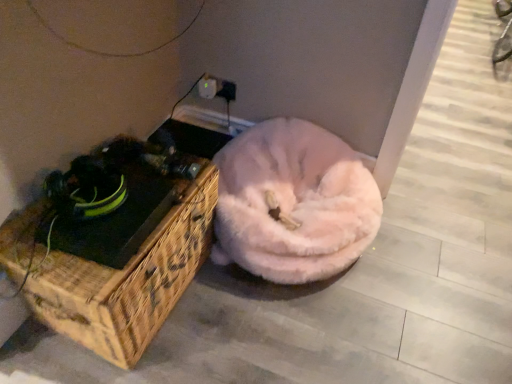
Image resolution: width=512 pixels, height=384 pixels. In order to click on fuzzy pink dog bed at center in this screenshot , I will do `click(293, 203)`.

The width and height of the screenshot is (512, 384). I want to click on white plastic electric outlet at upper center, so click(x=207, y=87).

This screenshot has height=384, width=512. I want to click on woven wood chest at left, so pos(115,258).

Considering the relative sizes of white plastic electric outlet at upper center and woven wood chest at left in the image provided, is white plastic electric outlet at upper center wider than woven wood chest at left?

No, white plastic electric outlet at upper center is not wider than woven wood chest at left.

From the image's perspective, between white plastic electric outlet at upper center and woven wood chest at left, who is located below?

woven wood chest at left, from the image's perspective.

Is woven wood chest at left a part of white plastic electric outlet at upper center?

No, woven wood chest at left is not a part of white plastic electric outlet at upper center.

Is white plastic electric outlet at upper center far away from woven wood chest at left?

No.

Can you tell me how much woven wood chest at left and fuzzy pink dog bed at center differ in facing direction?

They differ by 90 degrees in their facing directions.

Measure the distance between woven wood chest at left and fuzzy pink dog bed at center.

A distance of 14.35 inches exists between woven wood chest at left and fuzzy pink dog bed at center.

Is woven wood chest at left taller than fuzzy pink dog bed at center?

Indeed, woven wood chest at left has a greater height compared to fuzzy pink dog bed at center.

From a real-world perspective, is woven wood chest at left located beneath fuzzy pink dog bed at center?

No, from a real-world perspective, woven wood chest at left is not under fuzzy pink dog bed at center.

Is point (117, 291) positioned behind point (208, 95)?

That is False.

Which of these two, woven wood chest at left or white plastic electric outlet at upper center, is thinner?

white plastic electric outlet at upper center is thinner.

Can you confirm if woven wood chest at left is smaller than white plastic electric outlet at upper center?

No, woven wood chest at left is not smaller than white plastic electric outlet at upper center.

Considering the sizes of woven wood chest at left and white plastic electric outlet at upper center in the image, is woven wood chest at left taller or shorter than white plastic electric outlet at upper center?

In the image, woven wood chest at left appears to be taller than white plastic electric outlet at upper center.

Based on the photo, from a real-world perspective, is white plastic electric outlet at upper center below fuzzy pink dog bed at center?

Incorrect, from a real-world perspective, white plastic electric outlet at upper center is higher than fuzzy pink dog bed at center.

Identify the location of dog bed to the right of white plastic electric outlet at upper center. (293, 203).

Is white plastic electric outlet at upper center looking in the opposite direction of fuzzy pink dog bed at center?

No, fuzzy pink dog bed at center is not at the back of white plastic electric outlet at upper center.

Does point (201, 79) come behind point (219, 171)?

Yes, point (201, 79) is behind point (219, 171).

From the picture: Could you tell me if fuzzy pink dog bed at center is facing woven wood chest at left?

No, fuzzy pink dog bed at center is not oriented towards woven wood chest at left.

From a real-world perspective, is fuzzy pink dog bed at center over woven wood chest at left?

No, from a real-world perspective, fuzzy pink dog bed at center is not above woven wood chest at left.

Which is behind, point (331, 200) or point (50, 321)?

The point (331, 200) is more distant.

What's the angular difference between fuzzy pink dog bed at center and woven wood chest at left's facing directions?

The angular difference between fuzzy pink dog bed at center and woven wood chest at left is 90 degrees.

Can you confirm if fuzzy pink dog bed at center is taller than white plastic electric outlet at upper center?

Yes.

From a real-world perspective, is fuzzy pink dog bed at center located beneath white plastic electric outlet at upper center?

Indeed, from a real-world perspective, fuzzy pink dog bed at center is positioned beneath white plastic electric outlet at upper center.

Can you tell me how much fuzzy pink dog bed at center and white plastic electric outlet at upper center differ in facing direction?

0.00282 degrees separate the facing orientations of fuzzy pink dog bed at center and white plastic electric outlet at upper center.

Is the surface of fuzzy pink dog bed at center in direct contact with white plastic electric outlet at upper center?

fuzzy pink dog bed at center and white plastic electric outlet at upper center are clearly separated.

What are the coordinates of `furniture below the white plastic electric outlet at upper center (from a real-world perspective)` in the screenshot? It's located at (115, 258).

Locate an element on the screen. The width and height of the screenshot is (512, 384). furniture that appears below the fuzzy pink dog bed at center (from the image's perspective) is located at coordinates (115, 258).

Based on their spatial positions, is fuzzy pink dog bed at center or woven wood chest at left further from white plastic electric outlet at upper center?

The object further to white plastic electric outlet at upper center is woven wood chest at left.

Considering their positions, is woven wood chest at left positioned further to fuzzy pink dog bed at center than white plastic electric outlet at upper center?

white plastic electric outlet at upper center is further to fuzzy pink dog bed at center.

When comparing their distances from woven wood chest at left, does fuzzy pink dog bed at center or white plastic electric outlet at upper center seem further?

white plastic electric outlet at upper center is positioned further to the anchor woven wood chest at left.

Looking at this image, looking at the image, which one is located further to woven wood chest at left, white plastic electric outlet at upper center or fuzzy pink dog bed at center?

white plastic electric outlet at upper center is positioned further to the anchor woven wood chest at left.

When comparing their distances from white plastic electric outlet at upper center, does woven wood chest at left or fuzzy pink dog bed at center seem closer?

fuzzy pink dog bed at center is closer to white plastic electric outlet at upper center.

When comparing their distances from fuzzy pink dog bed at center, does white plastic electric outlet at upper center or woven wood chest at left seem further?

white plastic electric outlet at upper center is further to fuzzy pink dog bed at center.

I want to click on dog bed between woven wood chest at left and white plastic electric outlet at upper center from front to back, so (293, 203).